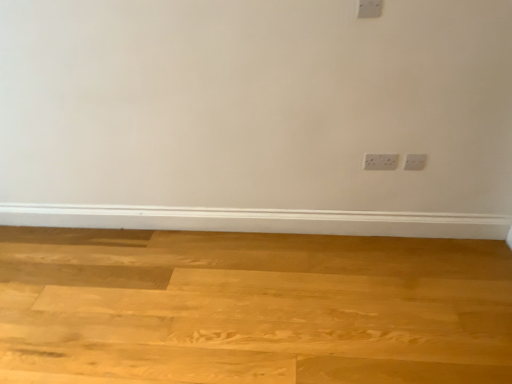
Question: Is white plastic power plugs and sockets at right next to natural wood plywood at lower center and touching it?

Choices:
 (A) no
 (B) yes

Answer: (A)

Question: Is white plastic power plugs and sockets at right not inside natural wood plywood at lower center?

Choices:
 (A) no
 (B) yes

Answer: (B)

Question: Is white plastic power plugs and sockets at right to the left of natural wood plywood at lower center from the viewer's perspective?

Choices:
 (A) yes
 (B) no

Answer: (B)

Question: Is natural wood plywood at lower center at the back of white plastic power plugs and sockets at right?

Choices:
 (A) yes
 (B) no

Answer: (B)

Question: Is natural wood plywood at lower center inside white plastic power plugs and sockets at right?

Choices:
 (A) no
 (B) yes

Answer: (A)

Question: Can you confirm if white plastic power plugs and sockets at right is smaller than natural wood plywood at lower center?

Choices:
 (A) yes
 (B) no

Answer: (A)

Question: Can you confirm if natural wood plywood at lower center is taller than white plastic power plugs and sockets at right?

Choices:
 (A) no
 (B) yes

Answer: (A)

Question: Does natural wood plywood at lower center come in front of white plastic power plugs and sockets at right?

Choices:
 (A) yes
 (B) no

Answer: (A)

Question: Is natural wood plywood at lower center turned away from white plastic power plugs and sockets at right?

Choices:
 (A) yes
 (B) no

Answer: (B)

Question: From a real-world perspective, is natural wood plywood at lower center positioned over white plastic power plugs and sockets at right based on gravity?

Choices:
 (A) no
 (B) yes

Answer: (A)

Question: From the image's perspective, is natural wood plywood at lower center beneath white plastic power plugs and sockets at right?

Choices:
 (A) no
 (B) yes

Answer: (B)

Question: From a real-world perspective, does natural wood plywood at lower center sit lower than white plastic power plugs and sockets at right?

Choices:
 (A) yes
 (B) no

Answer: (A)

Question: Is white plastic power plugs and sockets at right to the left or to the right of natural wood plywood at lower center in the image?

Choices:
 (A) left
 (B) right

Answer: (B)